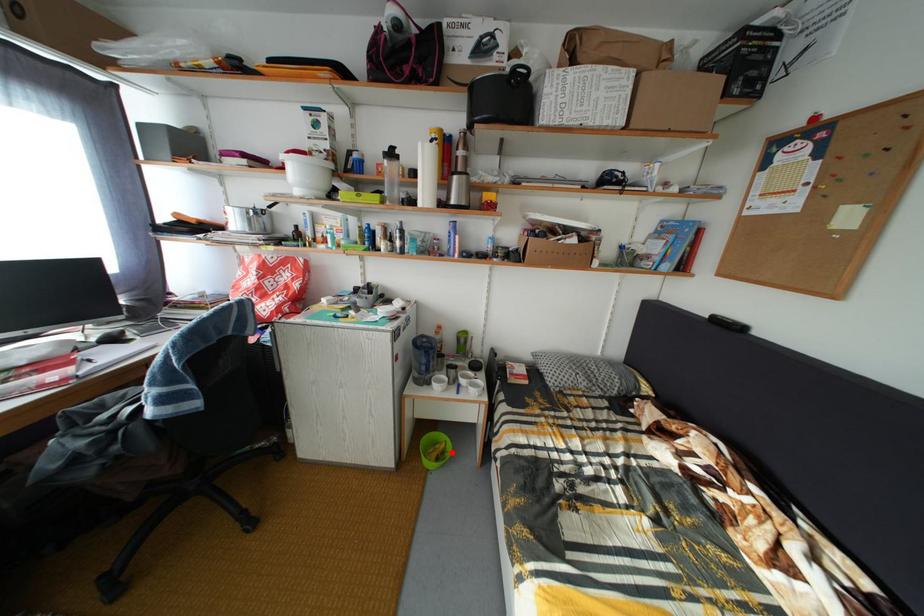
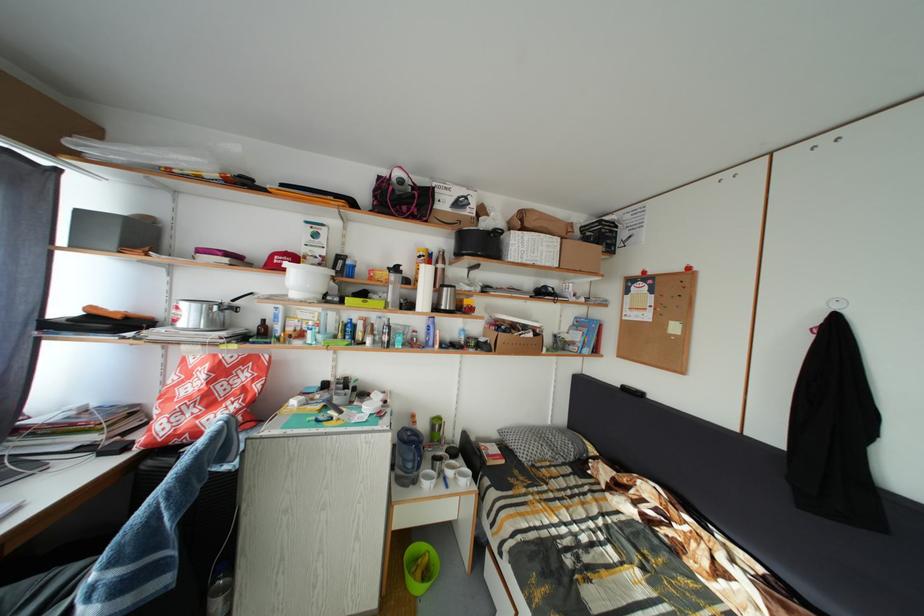
Question: I am providing you with two images of the same scene from different viewpoints. In image1, a red point is highlighted. Considering the same 3D point in image2, which of the following is correct?

Choices:
 (A) It is closer
 (B) It is farther

Answer: (A)